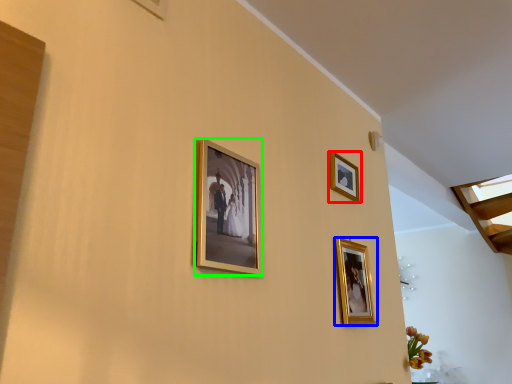
Question: Which is farther away from picture frame (highlighted by a red box)? picture frame (highlighted by a blue box) or picture frame (highlighted by a green box)?

Choices:
 (A) picture frame
 (B) picture frame

Answer: (B)